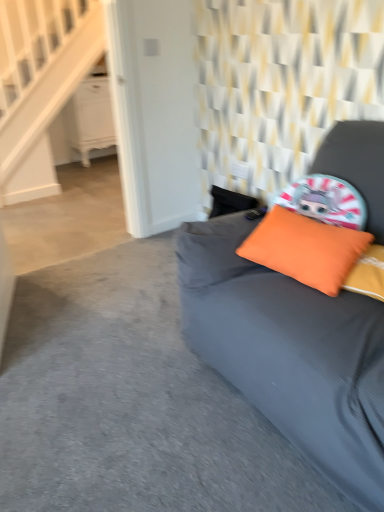
Measure the distance between point (69, 138) and camera.

4.40 meters.

Find the location of a particular element. The width and height of the screenshot is (384, 512). matte gray studio couch at center is located at coordinates (290, 352).

Find the location of a particular element. This screenshot has height=512, width=384. orange fabric pillow at upper right is located at coordinates (305, 249).

Is orange fabric pillow at upper right bigger or smaller than matte gray studio couch at center?

Considering their sizes, orange fabric pillow at upper right takes up less space than matte gray studio couch at center.

Based on the photo, from a real-world perspective, which object rests below the other?

matte gray studio couch at center, from a real-world perspective.

Can matte gray studio couch at center be found inside orange fabric pillow at upper right?

Definitely not — matte gray studio couch at center is not inside orange fabric pillow at upper right.

Considering the points (339, 277) and (178, 259), which point is behind, point (339, 277) or point (178, 259)?

Positioned behind is point (178, 259).

Is matte gray studio couch at center situated inside orange fabric pillow at upper right or outside?

matte gray studio couch at center is not inside orange fabric pillow at upper right, it's outside.

From the image's perspective, between matte gray studio couch at center and orange fabric pillow at upper right, which one is located above?

From the image's view, orange fabric pillow at upper right is above.

Is point (377, 466) closer or farther from the camera than point (315, 225)?

Point (377, 466) is closer to the camera than point (315, 225).

Which of these two, white glossy dresser at upper left or orange fabric pillow at upper right, is bigger?

white glossy dresser at upper left is bigger.

The image size is (384, 512). What are the coordinates of `pillow in front of the white glossy dresser at upper left` in the screenshot? It's located at (305, 249).

From the image's perspective, is white glossy dresser at upper left above orange fabric pillow at upper right?

Yes, from the image's perspective, white glossy dresser at upper left is on top of orange fabric pillow at upper right.

Which is behind, point (108, 137) or point (307, 283)?

The point (108, 137) is farther.

Who is shorter, matte gray studio couch at center or white glossy dresser at upper left?

white glossy dresser at upper left.

Is matte gray studio couch at center not inside white glossy dresser at upper left?

Absolutely, matte gray studio couch at center is external to white glossy dresser at upper left.

Is matte gray studio couch at center next to white glossy dresser at upper left?

matte gray studio couch at center and white glossy dresser at upper left are clearly separated.

In the image, is matte gray studio couch at center on the left side or the right side of white glossy dresser at upper left?

matte gray studio couch at center is to the right of white glossy dresser at upper left.

From a real-world perspective, which object stands above the other?

From a 3D spatial view, white wood stairwell at upper left is above.

Is white glossy dresser at upper left not close to white wood stairwell at upper left?

No, there isn't a large distance between white glossy dresser at upper left and white wood stairwell at upper left.

Looking at this image, does white glossy dresser at upper left have a greater width compared to white wood stairwell at upper left?

Yes, white glossy dresser at upper left is wider than white wood stairwell at upper left.

Is white glossy dresser at upper left not inside white wood stairwell at upper left?

Indeed, white glossy dresser at upper left is completely outside white wood stairwell at upper left.

Who is smaller, orange fabric pillow at upper right or white glossy dresser at upper left?

With smaller size is orange fabric pillow at upper right.

Between orange fabric pillow at upper right and white glossy dresser at upper left, which one appears on the right side from the viewer's perspective?

Positioned to the right is orange fabric pillow at upper right.

Consider the image. Who is taller, orange fabric pillow at upper right or white glossy dresser at upper left?

With more height is white glossy dresser at upper left.

Does matte gray studio couch at center appear on the right side of white wood stairwell at upper left?

Yes.

From a real-world perspective, relative to white wood stairwell at upper left, is matte gray studio couch at center vertically above or below?

matte gray studio couch at center is situated lower than white wood stairwell at upper left in the real world.

Does matte gray studio couch at center come behind white wood stairwell at upper left?

That is False.

What's the angular difference between matte gray studio couch at center and white wood stairwell at upper left's facing directions?

They differ by 88.1 degrees in their facing directions.

Find the location of a particular element. This screenshot has width=384, height=512. studio couch on the right of orange fabric pillow at upper right is located at coordinates (290, 352).

At what (x,y) coordinates should I click in order to perform the action: click on pillow that appears behind the matte gray studio couch at center. Please return your answer as a coordinate pair (x, y). The image size is (384, 512). Looking at the image, I should click on (305, 249).

From the image, which object appears to be nearer to white glossy dresser at upper left, matte gray studio couch at center or orange fabric pillow at upper right?

matte gray studio couch at center.

Estimate the real-world distances between objects in this image. Which object is closer to orange fabric pillow at upper right, white wood stairwell at upper left or white glossy dresser at upper left?

Among the two, white wood stairwell at upper left is located nearer to orange fabric pillow at upper right.

From the image, which object appears to be farther from white glossy dresser at upper left, white wood stairwell at upper left or matte gray studio couch at center?

matte gray studio couch at center.

Estimate the real-world distances between objects in this image. Which object is further from matte gray studio couch at center, white wood stairwell at upper left or orange fabric pillow at upper right?

white wood stairwell at upper left is positioned further to the anchor matte gray studio couch at center.

Based on their spatial positions, is matte gray studio couch at center or white wood stairwell at upper left closer to orange fabric pillow at upper right?

Among the two, matte gray studio couch at center is located nearer to orange fabric pillow at upper right.

Estimate the real-world distances between objects in this image. Which object is further from matte gray studio couch at center, white glossy dresser at upper left or white wood stairwell at upper left?

Among the two, white glossy dresser at upper left is located further to matte gray studio couch at center.

Which object lies nearer to the anchor point matte gray studio couch at center, white wood stairwell at upper left or white glossy dresser at upper left?

Among the two, white wood stairwell at upper left is located nearer to matte gray studio couch at center.

When comparing their distances from white glossy dresser at upper left, does orange fabric pillow at upper right or matte gray studio couch at center seem further?

Based on the image, orange fabric pillow at upper right appears to be further to white glossy dresser at upper left.

Where is `pillow located between matte gray studio couch at center and white wood stairwell at upper left in the depth direction`? Image resolution: width=384 pixels, height=512 pixels. pillow located between matte gray studio couch at center and white wood stairwell at upper left in the depth direction is located at coordinates (305, 249).

I want to click on pillow positioned between matte gray studio couch at center and white glossy dresser at upper left from near to far, so click(305, 249).

Locate an element on the screen. The height and width of the screenshot is (512, 384). stairwell between matte gray studio couch at center and white glossy dresser at upper left along the z-axis is located at coordinates (40, 84).

Locate an element on the screen. Image resolution: width=384 pixels, height=512 pixels. stairwell between orange fabric pillow at upper right and white glossy dresser at upper left in the front-back direction is located at coordinates (40, 84).